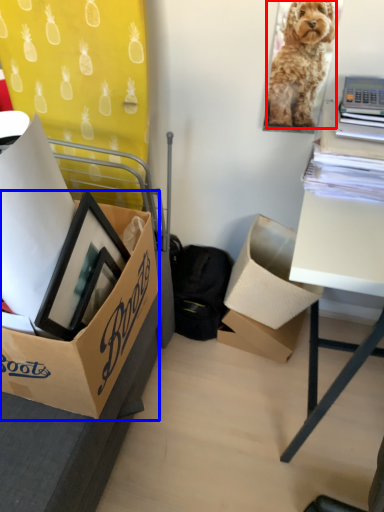
Question: Which object is closer to the camera taking this photo, dog (highlighted by a red box) or box (highlighted by a blue box)?

Choices:
 (A) dog
 (B) box

Answer: (B)